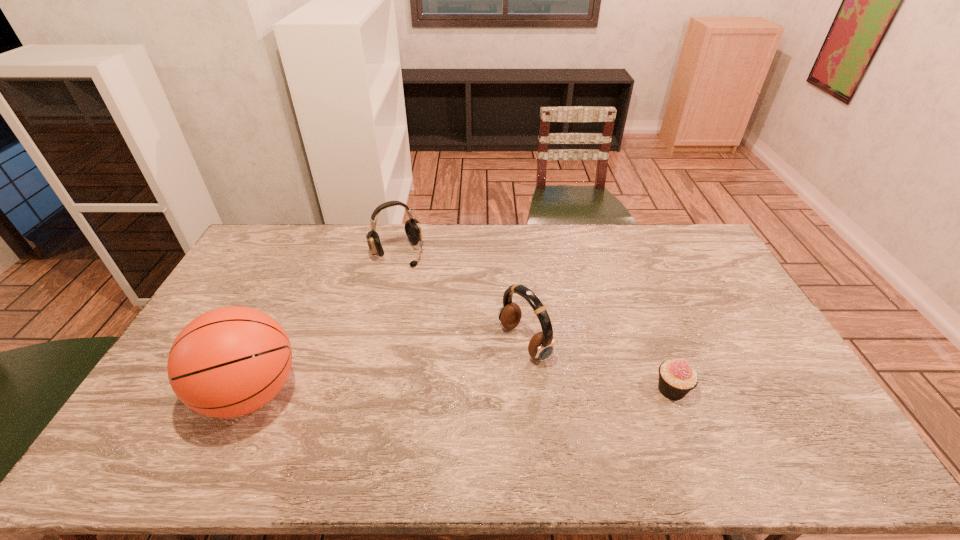
This screenshot has width=960, height=540. In order to click on vacant spot on the desktop that is between the leftmost object and the cupcake and is positioned on the ear cup of the second object from right to left in this screenshot , I will do pyautogui.click(x=428, y=392).

Find the location of `free space on the desktop that is between the leftmost object and the shortest object and is positioned with the microphone on the side of the third object from right to left`. free space on the desktop that is between the leftmost object and the shortest object and is positioned with the microphone on the side of the third object from right to left is located at coordinates (495, 391).